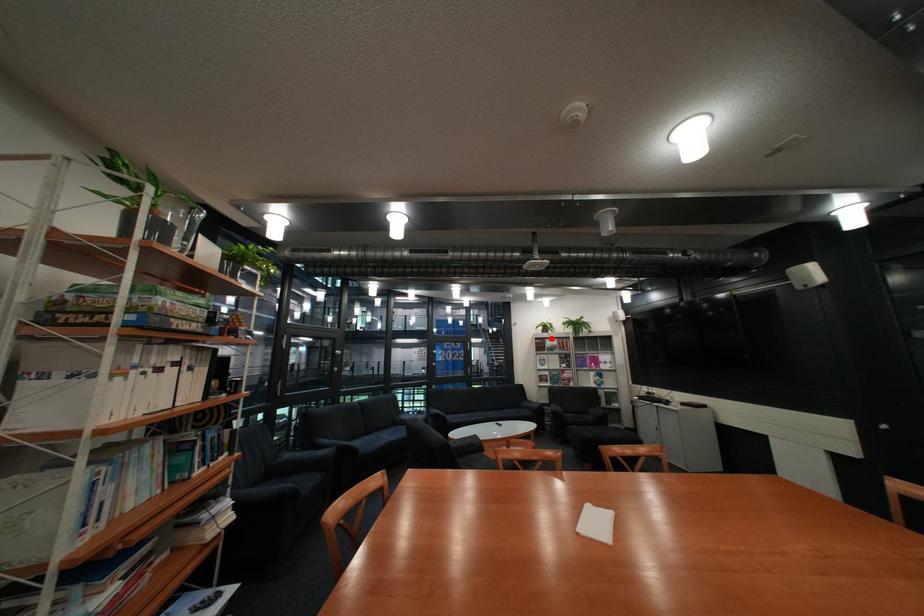
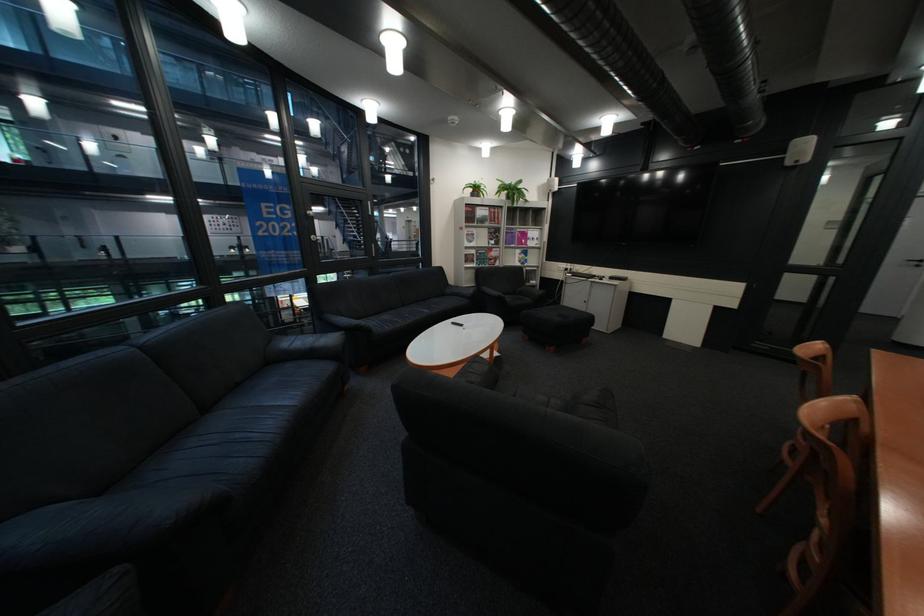
Locate, in the second image, the point that corresponds to the highlighted location in the first image.

(481, 205)